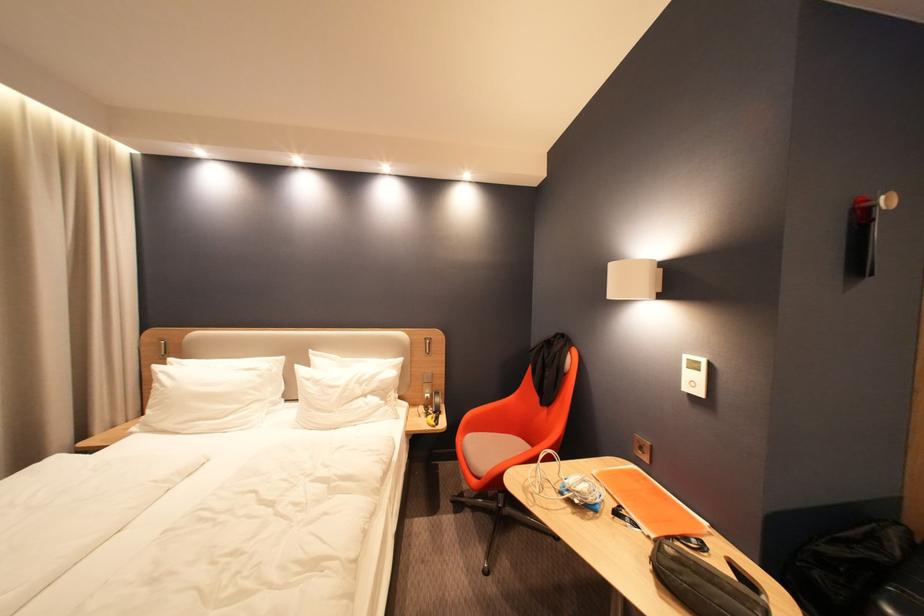
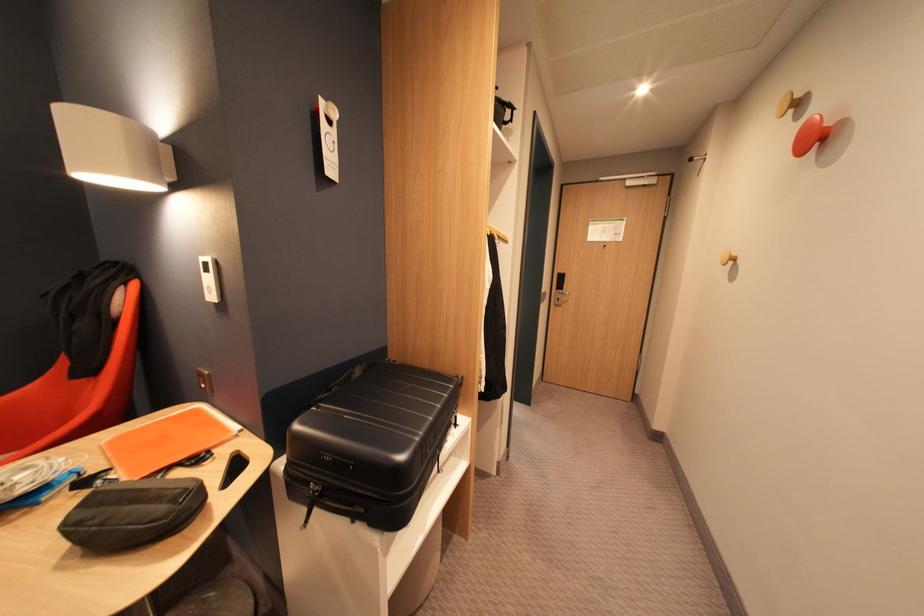
Locate, in the second image, the point that corresponds to (710,363) in the first image.

(216, 265)